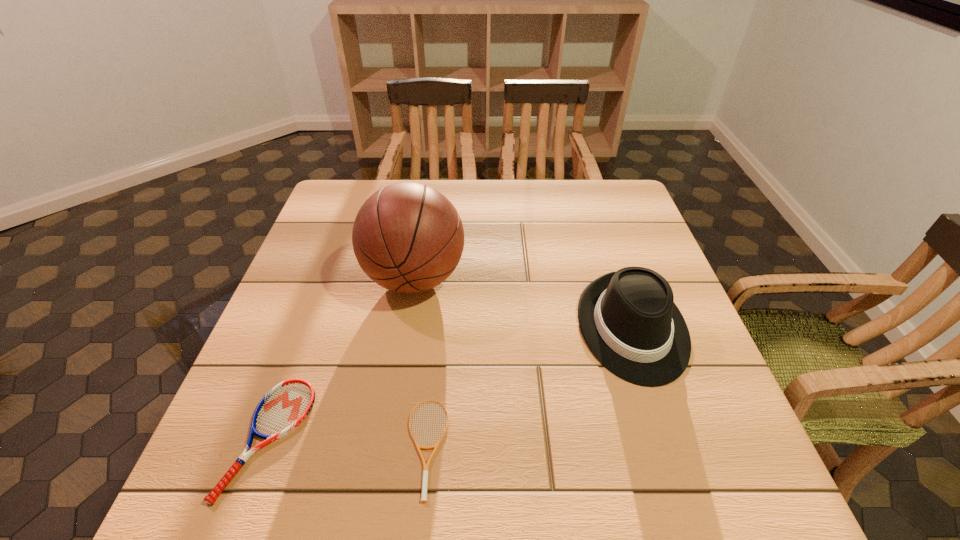
Locate an element on the screen. free space between the tallest object and the third tallest object is located at coordinates (342, 358).

Image resolution: width=960 pixels, height=540 pixels. In order to click on blank region between the leftmost object and the fedora in this screenshot , I will do `click(450, 382)`.

I want to click on empty space that is in between the rightmost object and the shorter tennis racket, so click(529, 387).

The width and height of the screenshot is (960, 540). Find the location of `free spot between the basketball and the leftmost object`. free spot between the basketball and the leftmost object is located at coordinates click(342, 358).

Find the location of a particular element. free space between the basketball and the fedora is located at coordinates (523, 303).

Where is `vacant space that's between the fedora and the basketball`? The height and width of the screenshot is (540, 960). vacant space that's between the fedora and the basketball is located at coordinates (523, 303).

I want to click on empty space that is in between the second shortest object and the right tennis racket, so click(348, 443).

You are a GUI agent. You are given a task and a screenshot of the screen. Output one action in this format:
    pyautogui.click(x=<x>, y=<y>)
    Task: Click on the unoccupied position between the shorter tennis racket and the tallest object
    
    Given the screenshot: What is the action you would take?
    pyautogui.click(x=420, y=363)

This screenshot has width=960, height=540. What are the coordinates of `vacant point located between the rightmost object and the right tennis racket` in the screenshot? It's located at (529, 387).

This screenshot has width=960, height=540. I want to click on vacant area that lies between the rightmost object and the left tennis racket, so click(x=450, y=382).